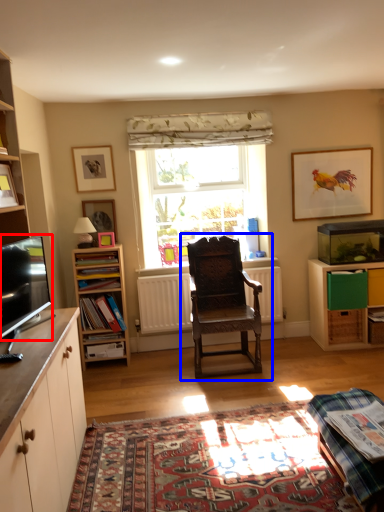
Question: Among these objects, which one is farthest to the camera, television (highlighted by a red box) or chair (highlighted by a blue box)?

Choices:
 (A) television
 (B) chair

Answer: (B)